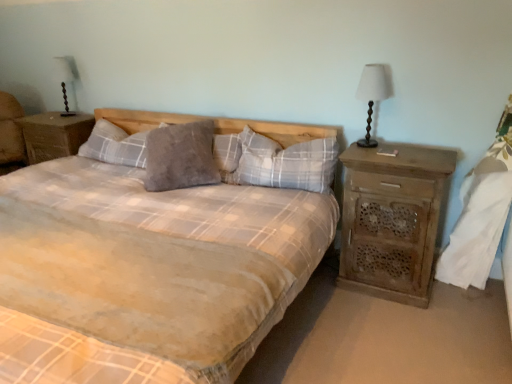
Identify the location of vacant area that is in front of rustic wood nightstand at right, acting as the second nightstand starting from the left. (404, 332).